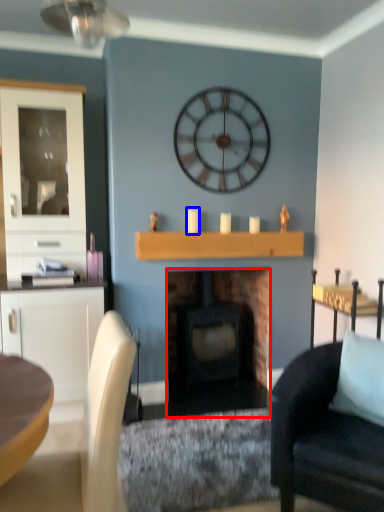
Question: Which object appears farthest to the camera in this image, fireplace (highlighted by a red box) or candle (highlighted by a blue box)?

Choices:
 (A) fireplace
 (B) candle

Answer: (A)